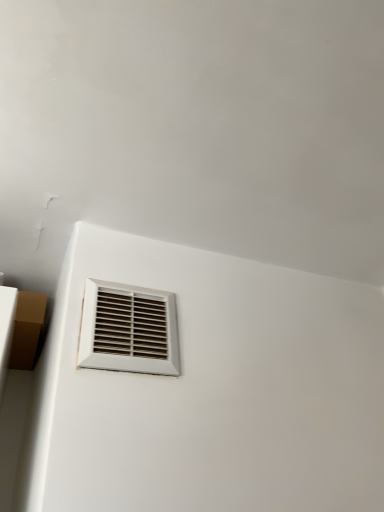
Describe the element at coordinates (128, 329) in the screenshot. The width and height of the screenshot is (384, 512). I see `white plastic vent at lower left` at that location.

Locate an element on the screen. The width and height of the screenshot is (384, 512). white plastic vent at lower left is located at coordinates (128, 329).

At what (x,y) coordinates should I click in order to perform the action: click on white plastic vent at lower left. Please return your answer as a coordinate pair (x, y). This screenshot has width=384, height=512. Looking at the image, I should click on (128, 329).